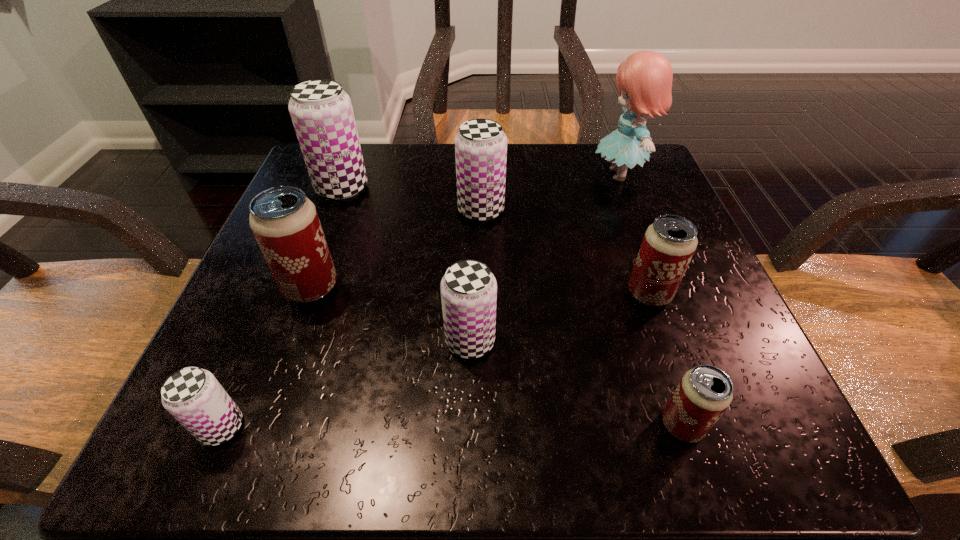
The height and width of the screenshot is (540, 960). In order to click on vacant area situated on the back of the nearest red beer can in this screenshot , I will do `click(652, 335)`.

Find the location of a particular element. The height and width of the screenshot is (540, 960). doll at the far edge is located at coordinates (644, 79).

Identify the location of doll that is at the right edge. This screenshot has width=960, height=540. (644, 79).

Find the location of `object at the far left corner`. object at the far left corner is located at coordinates (321, 111).

This screenshot has width=960, height=540. In order to click on object that is at the near left corner in this screenshot , I will do `click(193, 396)`.

What are the coordinates of `object at the far right corner` in the screenshot? It's located at (644, 79).

Where is `object located at the near right corner`? object located at the near right corner is located at coordinates (704, 393).

At what (x,y) coordinates should I click in order to perform the action: click on free space at the far edge of the desktop. Please return your answer as a coordinate pair (x, y). The width and height of the screenshot is (960, 540). Looking at the image, I should click on (539, 178).

The width and height of the screenshot is (960, 540). I want to click on vacant space at the near edge of the desktop, so click(393, 451).

The width and height of the screenshot is (960, 540). I want to click on blank area at the left edge, so click(x=279, y=370).